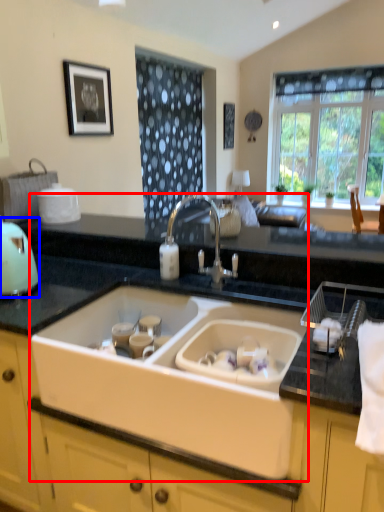
Question: Which point is further to the camera, sink (highlighted by a red box) or appliance (highlighted by a blue box)?

Choices:
 (A) sink
 (B) appliance

Answer: (B)